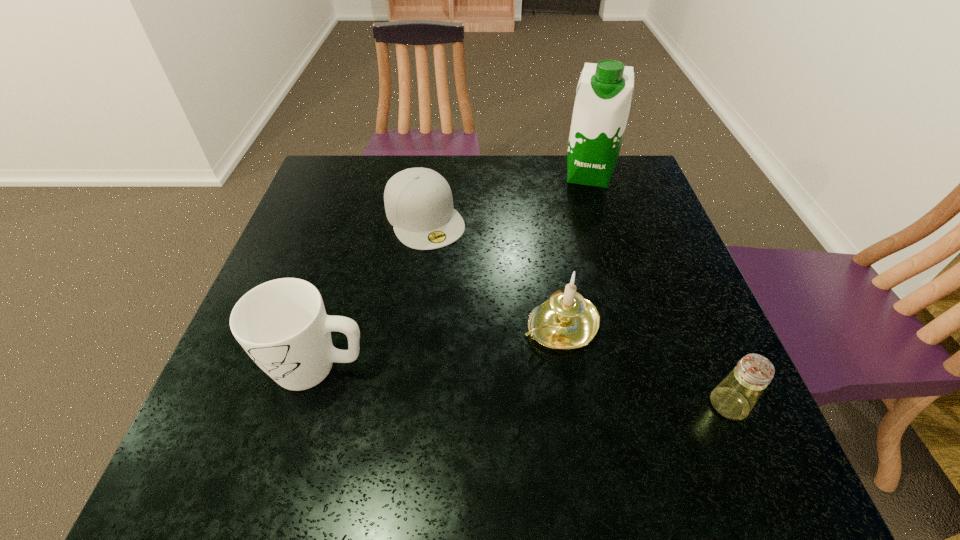
Locate an element on the screen. mug is located at coordinates (282, 324).

Where is `the rightmost object`? This screenshot has height=540, width=960. the rightmost object is located at coordinates (734, 397).

Find the location of a particular element. This screenshot has height=540, width=960. the fourth tallest object is located at coordinates (734, 397).

Where is `candle holder`? This screenshot has width=960, height=540. candle holder is located at coordinates (566, 321).

Find the location of `the shortest object`. the shortest object is located at coordinates (418, 202).

Find the location of `soya milk`. soya milk is located at coordinates (602, 104).

Identify the location of free space located on the left of the saltshaker. The image size is (960, 540). [637, 405].

Identify the location of vacant space located 0.060m on the handle side of the candle holder. The width and height of the screenshot is (960, 540). (507, 357).

Locate an element on the screen. The height and width of the screenshot is (540, 960). vacant space located on the handle side of the candle holder is located at coordinates (409, 419).

The image size is (960, 540). Identify the location of vacant area situated 0.200m on the handle side of the candle holder. (447, 395).